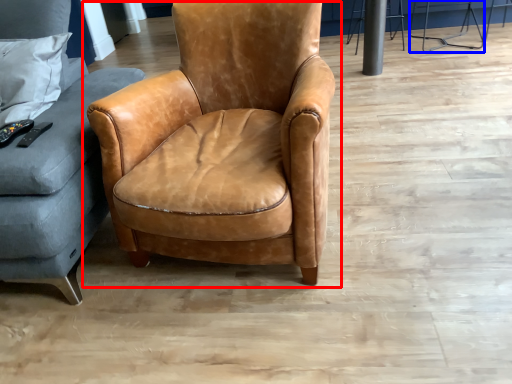
Question: Which object appears closest to the camera in this image, chair (highlighted by a red box) or bar stool (highlighted by a blue box)?

Choices:
 (A) chair
 (B) bar stool

Answer: (A)